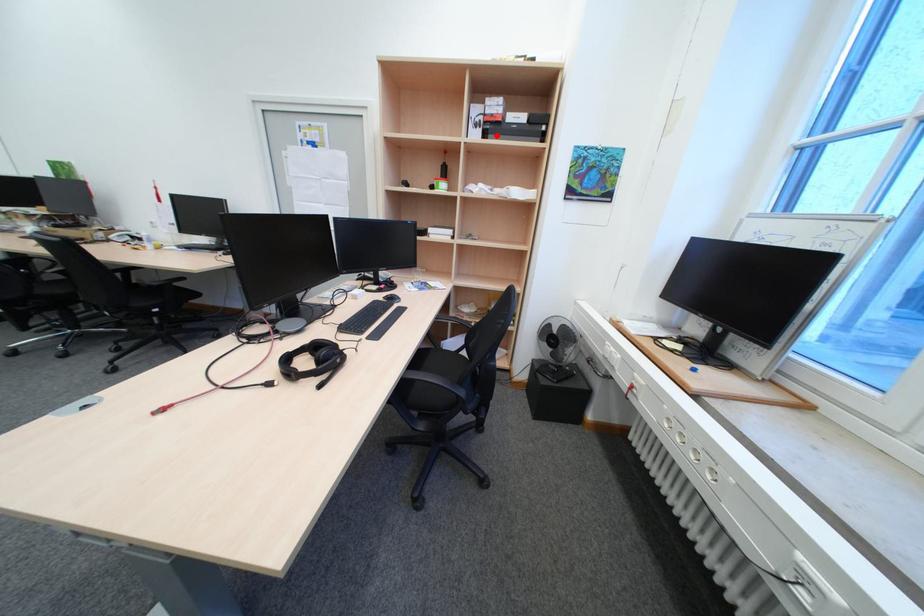
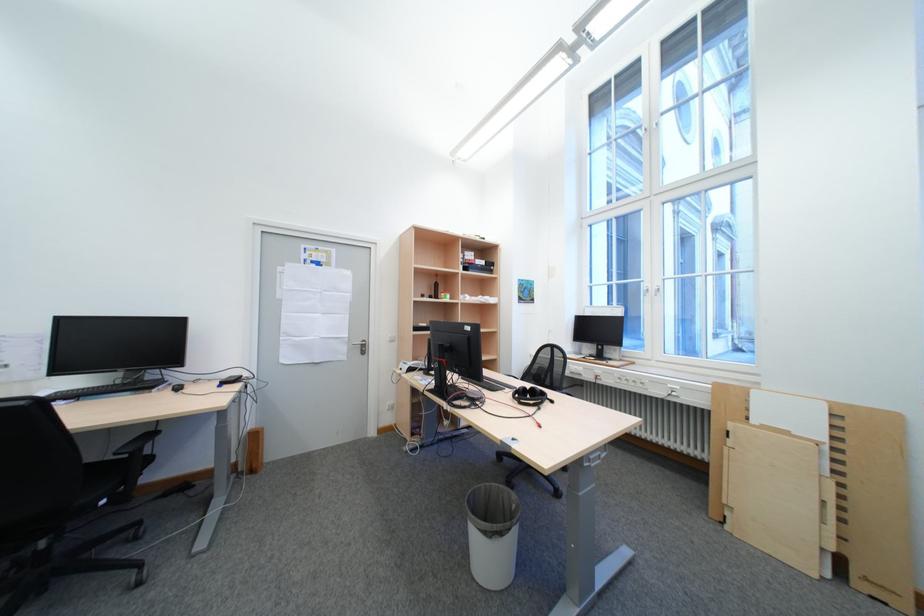
In the second image, find the point that corresponds to the highlighted location in the first image.

(477, 270)